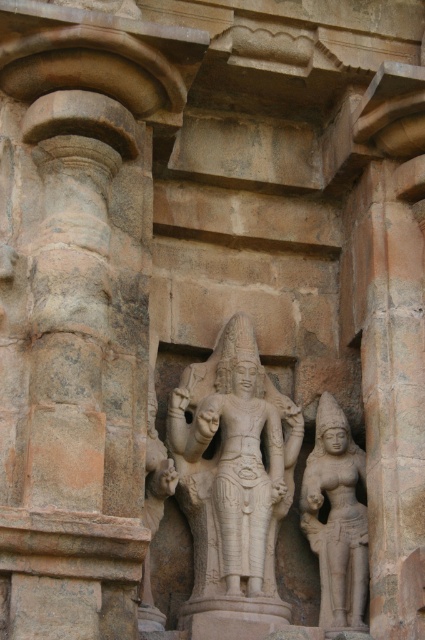
You are an archaeologist examining the ancient stone structure. You notice the white stone statue at center and the smooth stone statue at right. Which statue is positioned nearer to your current viewpoint?

The white stone statue at center is closer to the viewer than the smooth stone statue at right, so the white stone statue at center is nearer to your viewpoint.